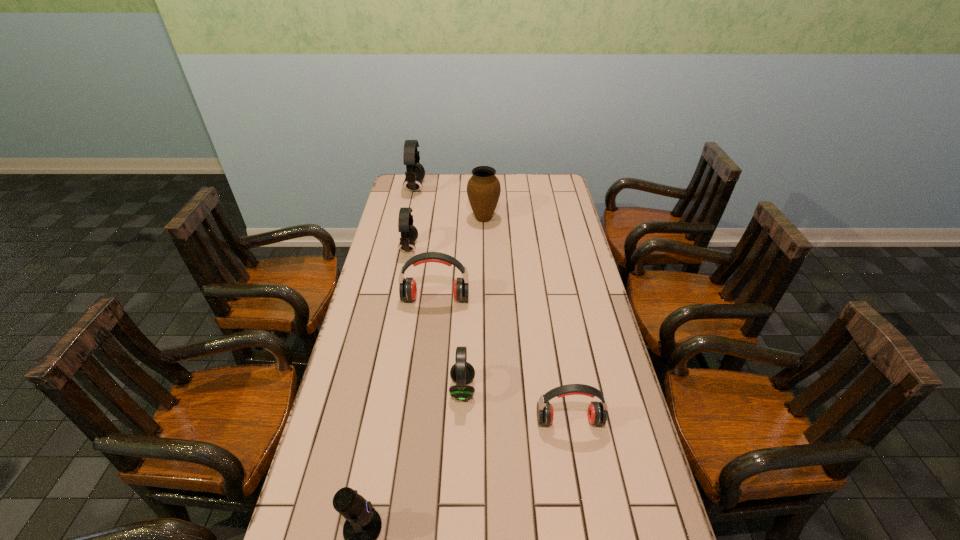
At what (x,y) coordinates should I click in order to perform the action: click on object at the far left corner. Please return your answer as a coordinate pair (x, y). Looking at the image, I should click on tap(415, 172).

This screenshot has height=540, width=960. In order to click on vacant area at the far edge in this screenshot , I will do `click(446, 184)`.

Locate an element on the screen. free space at the left edge of the desktop is located at coordinates [384, 286].

Find the location of a particular element. This screenshot has width=960, height=540. blank space at the right edge of the desktop is located at coordinates (579, 412).

At what (x,y) coordinates should I click in order to perform the action: click on blank area at the far left corner. Please return your answer as a coordinate pair (x, y). The height and width of the screenshot is (540, 960). Looking at the image, I should click on (395, 198).

Where is `empty space that is in between the second farthest earphone and the black headset`? This screenshot has width=960, height=540. empty space that is in between the second farthest earphone and the black headset is located at coordinates (436, 319).

Where is `free point between the black headset and the farthest object`? Image resolution: width=960 pixels, height=540 pixels. free point between the black headset and the farthest object is located at coordinates (439, 288).

Locate an element on the screen. The width and height of the screenshot is (960, 540). free space between the third nearest earphone and the headset is located at coordinates (436, 319).

Identify which object is the third nearest to the rightmost earphone. Please provide its 2D coordinates. Your answer should be formatted as a tuple, i.e. [(x, y)], where the tuple contains the x and y coordinates of a point satisfying the conditions above.

[(407, 287)]

You are a GUI agent. You are given a task and a screenshot of the screen. Output one action in this format:
    pyautogui.click(x=<x>, y=<y>)
    Task: Click on the object that can be found as the fourth closest to the tallest earphone
    This screenshot has height=540, width=960.
    Given the screenshot: What is the action you would take?
    pyautogui.click(x=462, y=372)